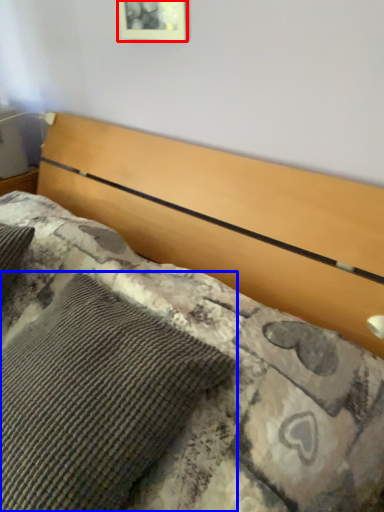
Question: Which point is further to the camera, picture frame (highlighted by a red box) or pillow (highlighted by a blue box)?

Choices:
 (A) picture frame
 (B) pillow

Answer: (A)